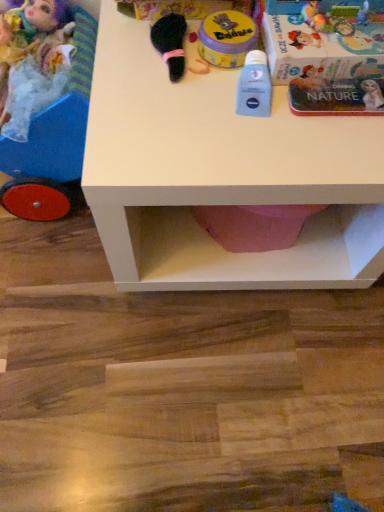
Find the location of a particular element. The image size is (384, 512). vacant space to the right of blue matte lotion at center, the 1th toy viewed from the right is located at coordinates (331, 138).